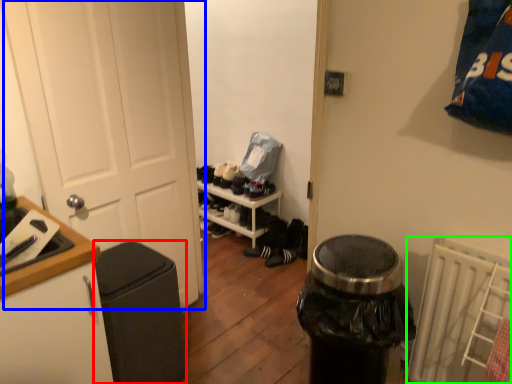
Question: Which object is the farthest from garbage (highlighted by a red box)? Choose among these: door (highlighted by a blue box) or radiator (highlighted by a green box).

Choices:
 (A) door
 (B) radiator

Answer: (B)